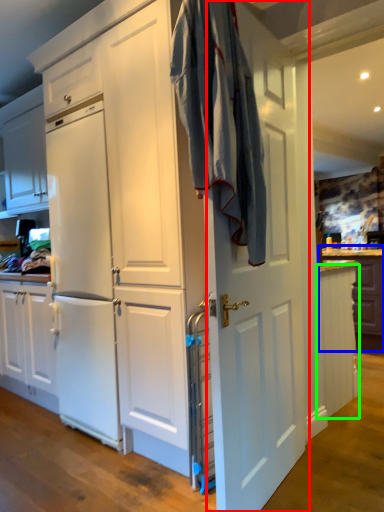
Question: Which is nearer to the door (highlighted by a red box)? counter (highlighted by a blue box) or cabinetry (highlighted by a green box).

Choices:
 (A) counter
 (B) cabinetry

Answer: (B)